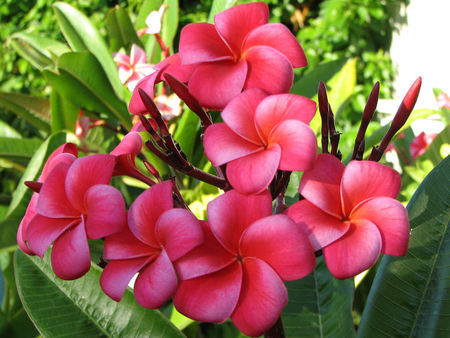
The height and width of the screenshot is (338, 450). I want to click on blurry bundle of flowers, so click(x=136, y=70), click(x=422, y=143).